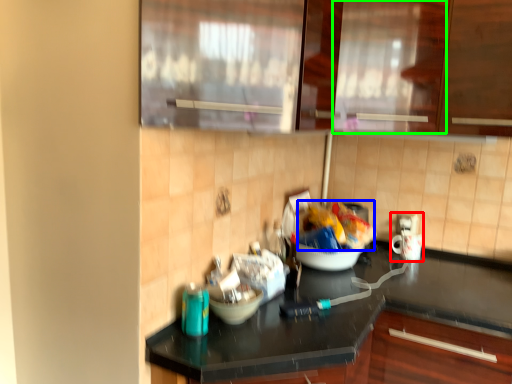
Question: Based on their relative distances, which object is nearer to appliance (highlighted by a red box)? Choose from food (highlighted by a blue box) and glass door (highlighted by a green box).

Choices:
 (A) food
 (B) glass door

Answer: (A)